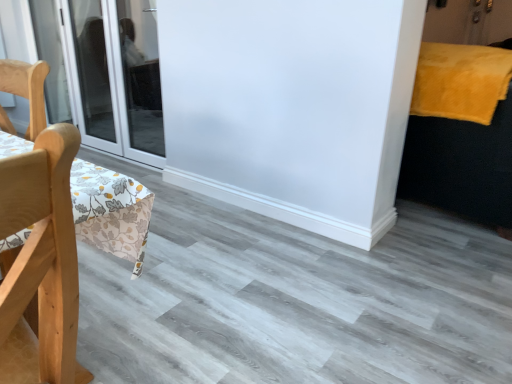
Question: From their relative heights in the image, would you say transparent glass door at left is taller or shorter than yellow fluffy blanket at upper right?

Choices:
 (A) tall
 (B) short

Answer: (A)

Question: Is transparent glass door at left spatially inside yellow fluffy blanket at upper right, or outside of it?

Choices:
 (A) outside
 (B) inside

Answer: (A)

Question: Which object is positioned farthest from the light wood chair at left?

Choices:
 (A) yellow fluffy blanket at upper right
 (B) velvet yellow bed at right
 (C) transparent glass door at left

Answer: (C)

Question: Which object is the closest to the light wood chair at left?

Choices:
 (A) transparent glass door at left
 (B) yellow fluffy blanket at upper right
 (C) velvet yellow bed at right

Answer: (B)